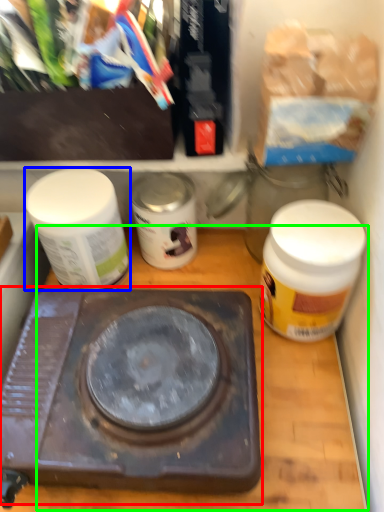
Question: Based on their relative distances, which object is farther from stove (highlighted by a red box)? Choose from bottle (highlighted by a blue box) and counter top (highlighted by a green box).

Choices:
 (A) bottle
 (B) counter top

Answer: (A)